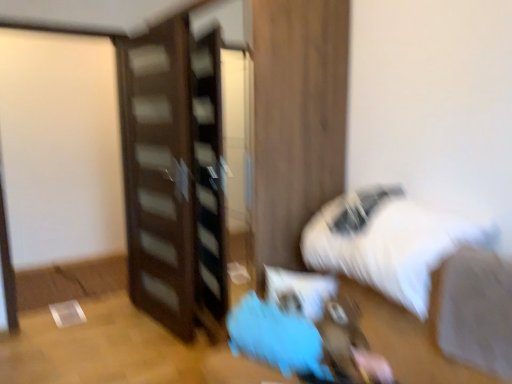
This screenshot has height=384, width=512. Find the location of `dark wood dresser at center`. dark wood dresser at center is located at coordinates (172, 178).

The image size is (512, 384). In order to click on white fabric at lower right in this screenshot , I will do click(476, 311).

Where is `dark wood dresser at center`? dark wood dresser at center is located at coordinates (172, 178).

From the image's perspective, is white fabric at lower right beneath blue fabric bean bag at lower center?

No, from the image's perspective, white fabric at lower right is not beneath blue fabric bean bag at lower center.

Is white fabric at lower right closer to camera compared to blue fabric bean bag at lower center?

Yes.

I want to click on bean bag chair located below the white fabric at lower right (from the image's perspective), so click(x=276, y=337).

Between white fabric at lower right and blue fabric bean bag at lower center, which one appears on the right side from the viewer's perspective?

Positioned to the right is white fabric at lower right.

There is a blue fabric bean bag at lower center. Where is `dresser above it (from a real-world perspective)`? dresser above it (from a real-world perspective) is located at coordinates (172, 178).

From the image's perspective, which one is positioned higher, dark wood dresser at center or blue fabric bean bag at lower center?

dark wood dresser at center, from the image's perspective.

Is dark wood dresser at center far away from blue fabric bean bag at lower center?

Yes, dark wood dresser at center is far from blue fabric bean bag at lower center.

In terms of size, does dark wood dresser at center appear bigger or smaller than blue fabric bean bag at lower center?

Considering their sizes, dark wood dresser at center takes up more space than blue fabric bean bag at lower center.

Is white fabric at lower right situated inside dark wood dresser at center or outside?

white fabric at lower right is not inside dark wood dresser at center, it's outside.

Who is shorter, white fabric at lower right or dark wood dresser at center?

white fabric at lower right is shorter.

From a real-world perspective, is white fabric at lower right physically located above or below dark wood dresser at center?

white fabric at lower right is below dark wood dresser at center.

Which of these two, blue fabric bean bag at lower center or white fluffy bed at lower right, is thinner?

blue fabric bean bag at lower center.

From the image's perspective, which one is positioned lower, blue fabric bean bag at lower center or white fluffy bed at lower right?

blue fabric bean bag at lower center, from the image's perspective.

Which point is more forward, [241,342] or [361,262]?

Point [361,262]

Is blue fabric bean bag at lower center completely or partially outside of white fluffy bed at lower right?

Indeed, blue fabric bean bag at lower center is completely outside white fluffy bed at lower right.

Which is behind, white fabric at lower right or white fluffy bed at lower right?

white fluffy bed at lower right is behind.

From the image's perspective, is white fabric at lower right located beneath white fluffy bed at lower right?

Indeed, from the image's perspective, white fabric at lower right is shown beneath white fluffy bed at lower right.

From their relative heights in the image, would you say white fabric at lower right is taller or shorter than white fluffy bed at lower right?

In the image, white fabric at lower right appears to be taller than white fluffy bed at lower right.

Looking at this image, which of these two, white fabric at lower right or white fluffy bed at lower right, is bigger?

white fluffy bed at lower right.

What's the angular difference between white fluffy bed at lower right and dark wood dresser at center's facing directions?

The angular difference between white fluffy bed at lower right and dark wood dresser at center is 0.386 degrees.

Between white fluffy bed at lower right and dark wood dresser at center, which one appears on the right side from the viewer's perspective?

white fluffy bed at lower right is more to the right.

From a real-world perspective, does white fluffy bed at lower right sit lower than dark wood dresser at center?

Yes.

Is white fluffy bed at lower right with dark wood dresser at center?

No, white fluffy bed at lower right is not touching dark wood dresser at center.

Is blue fabric bean bag at lower center behind white fabric at lower right?

Yes, blue fabric bean bag at lower center is behind white fabric at lower right.

Image resolution: width=512 pixels, height=384 pixels. I want to click on sheet that is in front of the blue fabric bean bag at lower center, so click(x=476, y=311).

Is blue fabric bean bag at lower center facing towards white fabric at lower right?

No, blue fabric bean bag at lower center is not aimed at white fabric at lower right.

Where is `bean bag chair below the white fabric at lower right (from the image's perspective)`? This screenshot has width=512, height=384. bean bag chair below the white fabric at lower right (from the image's perspective) is located at coordinates (276, 337).

At what (x,y) coordinates should I click in order to perform the action: click on bean bag chair on the right of dark wood dresser at center. Please return your answer as a coordinate pair (x, y). This screenshot has width=512, height=384. Looking at the image, I should click on (276, 337).

Looking at the image, which one is located further to dark wood dresser at center, white fabric at lower right or blue fabric bean bag at lower center?

white fabric at lower right is further to dark wood dresser at center.

Based on their spatial positions, is white fluffy bed at lower right or white fabric at lower right further from blue fabric bean bag at lower center?

white fabric at lower right lies further to blue fabric bean bag at lower center than the other object.

Which object lies further to the anchor point dark wood dresser at center, white fluffy bed at lower right or blue fabric bean bag at lower center?

white fluffy bed at lower right is positioned further to the anchor dark wood dresser at center.

Based on their spatial positions, is white fabric at lower right or white fluffy bed at lower right further from blue fabric bean bag at lower center?

white fabric at lower right.

When comparing their distances from blue fabric bean bag at lower center, does white fluffy bed at lower right or dark wood dresser at center seem closer?

white fluffy bed at lower right lies closer to blue fabric bean bag at lower center than the other object.

Based on their spatial positions, is white fluffy bed at lower right or blue fabric bean bag at lower center further from white fabric at lower right?

blue fabric bean bag at lower center is further to white fabric at lower right.

When comparing their distances from white fabric at lower right, does blue fabric bean bag at lower center or white fluffy bed at lower right seem closer?

white fluffy bed at lower right.

Estimate the real-world distances between objects in this image. Which object is closer to white fluffy bed at lower right, white fabric at lower right or blue fabric bean bag at lower center?

The object closer to white fluffy bed at lower right is white fabric at lower right.

At what (x,y) coordinates should I click in order to perform the action: click on bed between dark wood dresser at center and blue fabric bean bag at lower center in the vertical direction. Please return your answer as a coordinate pair (x, y). This screenshot has width=512, height=384. Looking at the image, I should click on (419, 282).

Where is `bed between blue fabric bean bag at lower center and white fabric at lower right from left to right`? This screenshot has height=384, width=512. bed between blue fabric bean bag at lower center and white fabric at lower right from left to right is located at coordinates (419, 282).

Identify the location of bed between dark wood dresser at center and white fabric at lower right from left to right. (419, 282).

Where is `bean bag chair between dark wood dresser at center and white fabric at lower right`? bean bag chair between dark wood dresser at center and white fabric at lower right is located at coordinates (276, 337).